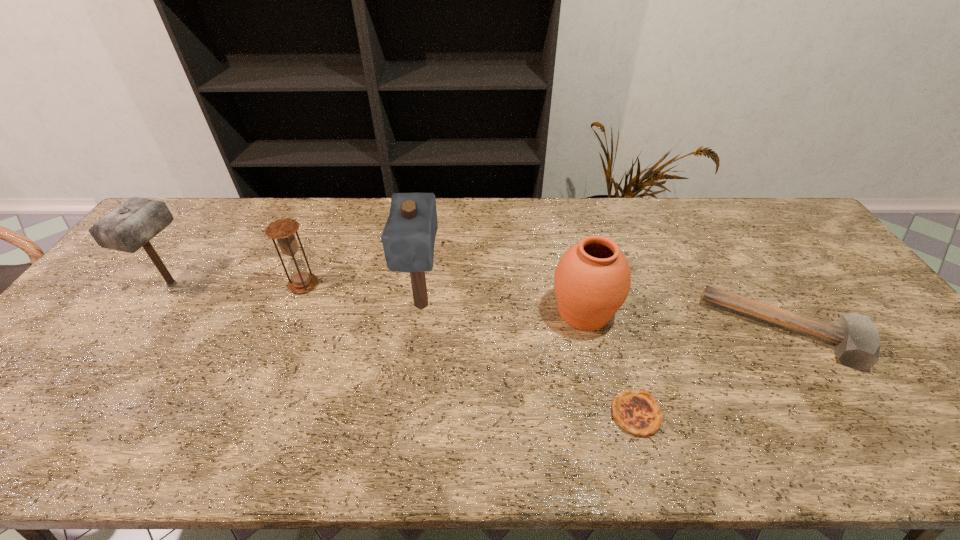
At what (x,y) coordinates should I click in order to perform the action: click on the fourth object from right to left. Please return your answer as a coordinate pair (x, y). The image size is (960, 540). Looking at the image, I should click on (408, 238).

What are the coordinates of `the leftmost mallet` in the screenshot? It's located at (133, 224).

At what (x,y) coordinates should I click in order to perform the action: click on urn. Please return your answer as a coordinate pair (x, y). The image size is (960, 540). Looking at the image, I should click on (592, 280).

Find the location of a particular element. hourglass is located at coordinates (283, 230).

I want to click on the shortest mallet, so click(856, 340).

In order to click on the rightmost mallet in this screenshot , I will do coord(856,340).

This screenshot has width=960, height=540. Find the location of `the nearest object`. the nearest object is located at coordinates (637, 412).

Image resolution: width=960 pixels, height=540 pixels. Find the location of `quiche`. quiche is located at coordinates (637, 412).

Find the location of a particular element. vacant region located 0.290m on the left of the third object from left to right is located at coordinates pyautogui.click(x=298, y=305).

Where is `vacant space located on the front of the leftmost mallet`? The height and width of the screenshot is (540, 960). vacant space located on the front of the leftmost mallet is located at coordinates [x=137, y=334].